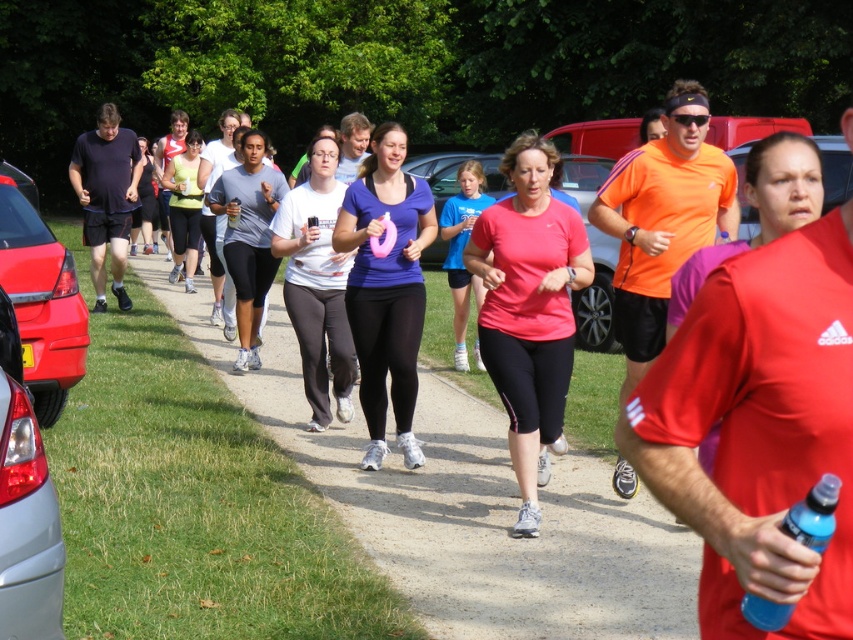
You are a photographer at the running event and want to take a photo of both the pink fabric shirt at center and the pink matte tank top at center. Which one should you focus on first if you want to capture them in order from left to right?

The pink matte tank top at center should be focused on first because it is positioned to the left of the pink fabric shirt at center.